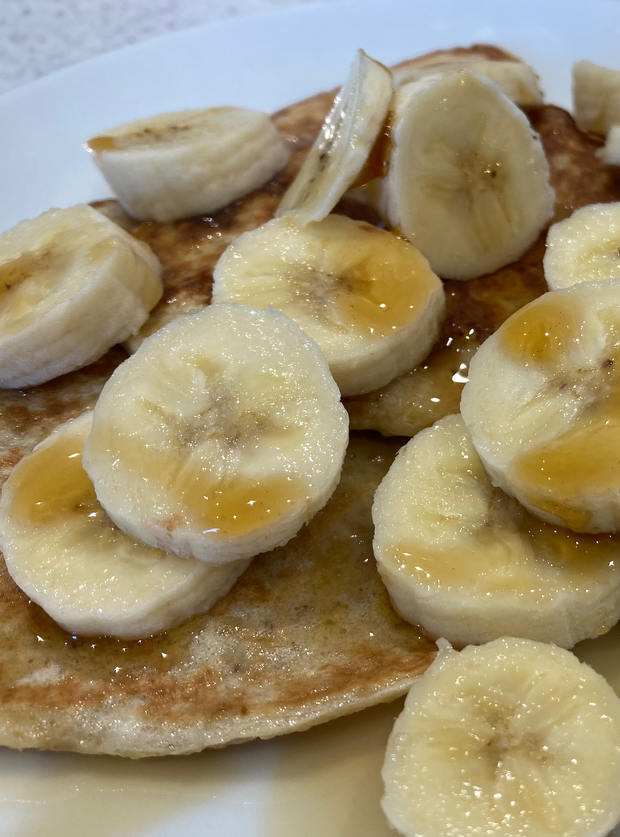
Image resolution: width=620 pixels, height=837 pixels. What are the coordinates of `plate in bottom left corner` in the screenshot? It's located at (19, 818).